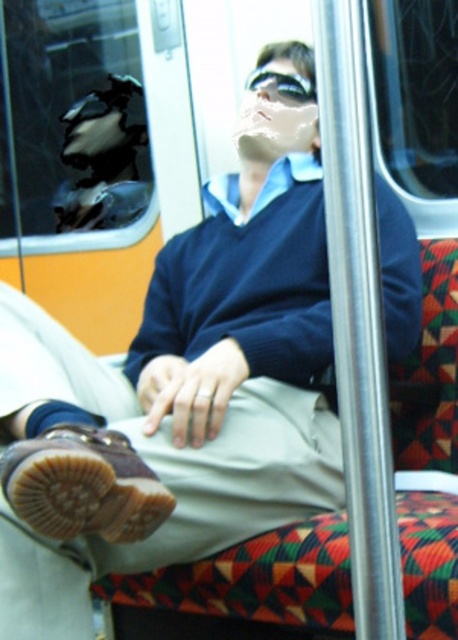
You are a passenger on a bus and see the brown suede shoe at lower left and the clear plastic goggles at upper center in the scene. Which object is taller?

The brown suede shoe at lower left is much taller than the clear plastic goggles at upper center.

You are a passenger on a train and need to find your clear plastic goggles at upper center. You remember placing them somewhere near your belongings. Looking at the scene, where would you check first based on their position relative to your brown suede shoe at lower left?

Since the brown suede shoe at lower left is located below the clear plastic goggles at upper center, you should check above your brown suede shoe at lower left to find the clear plastic goggles at upper center.

Looking at this image, you are a photographer trying to capture a closeup of the brown suede shoe at lower left. The camera you are using has a minimum focusing distance of 1 meter. Based on the scene description, can you successfully take a clear photo of the shoe?

The brown suede shoe at lower left is 85.09 centimeters away from camera. Since the minimum focusing distance is 1 meter, the camera cannot focus on the shoe as it is too close. You need to move the camera back or have the subject move forward to increase the distance to at least 1 meter for a clear photo.